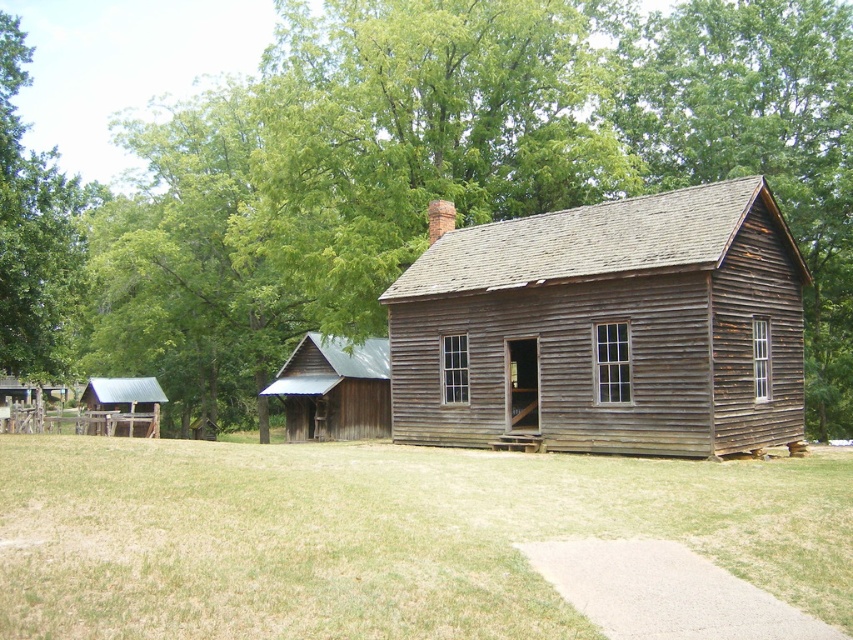
Is weathered wood log cabin at center in front of green leafy tree at upper left?

Yes.

Is weathered wood log cabin at center shorter than green leafy tree at upper left?

Yes, weathered wood log cabin at center is shorter than green leafy tree at upper left.

Find the location of a particular element. This screenshot has height=640, width=853. weathered wood log cabin at center is located at coordinates (606, 326).

Who is taller, green grass at lower center or weathered wood log cabin at center?

Standing taller between the two is weathered wood log cabin at center.

Is green grass at lower center further to the viewer compared to weathered wood log cabin at center?

No.

I want to click on green grass at lower center, so click(x=379, y=536).

Is point (656, 337) behind point (97, 410)?

No.

Consider the image. Is weathered wood log cabin at center positioned behind rustic wood barn at left?

No, weathered wood log cabin at center is closer to the viewer.

I want to click on weathered wood log cabin at center, so click(x=606, y=326).